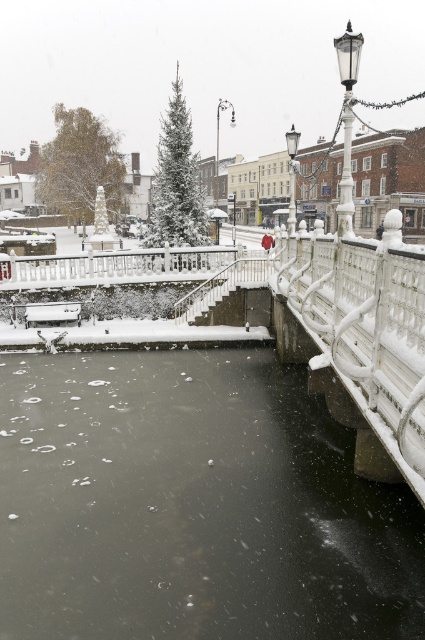
Who is shorter, black ice at center or white glossy rail at center?

With less height is black ice at center.

Find the location of a particular element. The height and width of the screenshot is (640, 425). black ice at center is located at coordinates (192, 506).

Where is `black ice at center`? black ice at center is located at coordinates (192, 506).

Between point (385, 400) and point (294, 205), which one is positioned in front?

Point (385, 400) is in front.

Which is below, white glossy rail at right or polished brass streetlamp at upper right?

white glossy rail at right is lower down.

You are a GUI agent. You are given a task and a screenshot of the screen. Output one action in this format:
    pyautogui.click(x=<x>, y=<y>)
    Task: Click on the white glossy rail at right
    The width and height of the screenshot is (425, 640).
    Given the screenshot: What is the action you would take?
    365,326

What do you see at coordinates (192, 506) in the screenshot?
I see `black ice at center` at bounding box center [192, 506].

Is black ice at center below white glossy rail at right?

Yes.

Where is `black ice at center`? black ice at center is located at coordinates (192, 506).

At what (x,y) coordinates should I click in order to perform the action: click on black ice at center. Please return your answer as a coordinate pair (x, y). The width and height of the screenshot is (425, 640). Looking at the image, I should click on (192, 506).